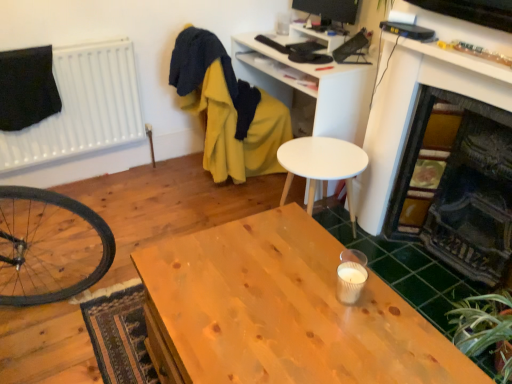
Question: In terms of size, does wooden table at center appear bigger or smaller than dark gray stone fireplace at right?

Choices:
 (A) small
 (B) big

Answer: (B)

Question: Is point (334, 349) closer or farther from the camera than point (419, 233)?

Choices:
 (A) closer
 (B) farther

Answer: (A)

Question: Based on their relative distances, which object is nearer to the dark gray stone fireplace at right?

Choices:
 (A) green leafy plant at lower right
 (B) black glossy monitor at upper center
 (C) white matte computer desk at upper center
 (D) black matte radiator at upper left
 (E) black fabric at upper left

Answer: (A)

Question: Estimate the real-world distances between objects in this image. Which object is farther from the yellow fabric swivel chair at upper center?

Choices:
 (A) green leafy plant at lower right
 (B) dark gray stone fireplace at right
 (C) wooden table at center
 (D) black glossy monitor at upper center
 (E) white matte side table at center

Answer: (A)